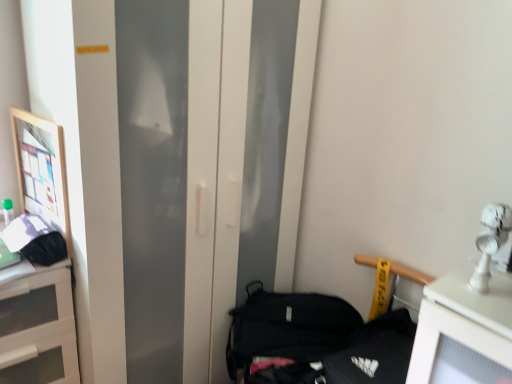
Question: From a real-world perspective, is matte black handbag at left, which is the second handbag in right-to-left order, physically located above or below black fabric handbag at lower right, the second handbag in the top-to-bottom sequence?

Choices:
 (A) above
 (B) below

Answer: (A)

Question: In the image, is matte black handbag at left, marked as the first handbag in a left-to-right arrangement, positioned in front of or behind black fabric handbag at lower right, the second handbag in the top-to-bottom sequence?

Choices:
 (A) behind
 (B) front

Answer: (B)

Question: Based on their relative distances, which object is farther from the black fabric handbag at lower right, the first handbag from the bottom?

Choices:
 (A) matte black handbag at left, which is the 2th handbag from bottom to top
 (B) white matte cabinet at left
 (C) wooden framed picture at left

Answer: (C)

Question: Which is nearer to the black fabric handbag at lower right, the second handbag in the top-to-bottom sequence?

Choices:
 (A) white matte cabinet at left
 (B) matte black handbag at left, which is the second handbag in right-to-left order
 (C) wooden framed picture at left

Answer: (A)